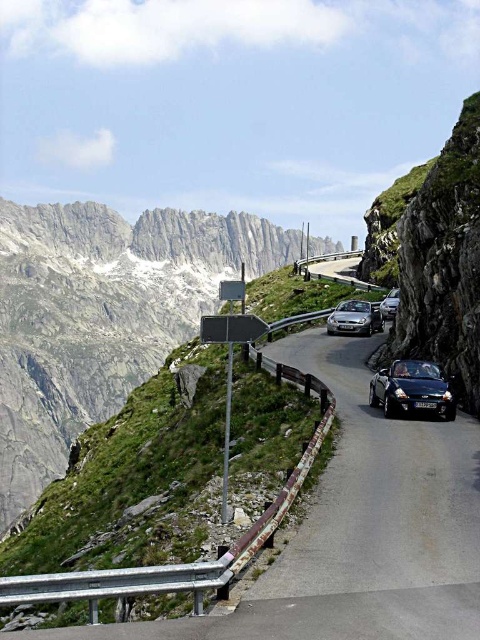
Question: Which of the following is the farthest from the observer?

Choices:
 (A) (319, 273)
 (B) (3, 522)

Answer: (B)

Question: Estimate the real-world distances between objects in this image. Which object is farther from the rugged stone mountain at upper left?

Choices:
 (A) metallic silver car at center
 (B) black matte convertible at center
 (C) metallic asphalt highway at center
 (D) metallic silver car at right

Answer: (D)

Question: Among these objects, which one is nearest to the camera?

Choices:
 (A) black matte convertible at center
 (B) metallic silver car at right
 (C) metallic asphalt highway at center
 (D) rugged stone mountain at upper left

Answer: (A)

Question: Is rugged stone mountain at upper left smaller than metallic silver car at right?

Choices:
 (A) no
 (B) yes

Answer: (A)

Question: Can you confirm if rugged stone mountain at upper left is wider than metallic silver car at right?

Choices:
 (A) no
 (B) yes

Answer: (B)

Question: Can you confirm if metallic asphalt highway at center is smaller than metallic silver car at center?

Choices:
 (A) yes
 (B) no

Answer: (B)